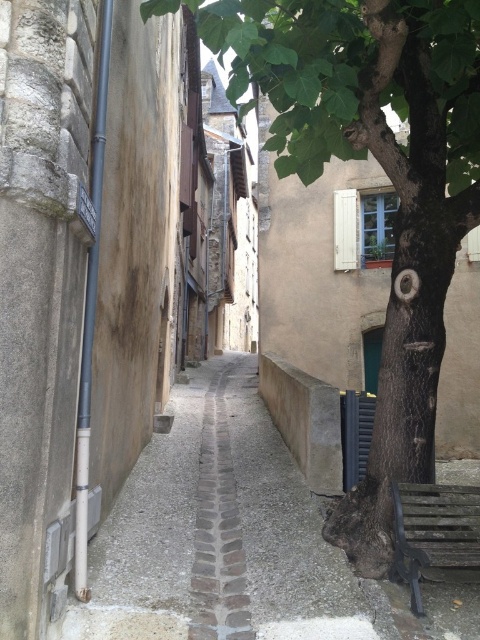
You are standing on the cobblestone street looking towards the buildings. There are two points marked on the ground. One is at point (377, 160) and the other is at point (214, 611). Which point is closer to you?

Point (377, 160) is further to the viewer than point (214, 611), so the point closer to you is point (214, 611).

You are standing in the middle of the gray cobblestone alley at center and want to walk towards the green rough bark tree at center. Which direction should you move to get closer to the tree?

Since the green rough bark tree at center is further to the viewer than the gray cobblestone alley at center, you should move forward along the alley to get closer to the tree.

You are a painter standing at the entrance of the gray cobblestone alley at center. You want to capture the green rough bark tree at center in your painting. Since you have a limited view, will the tree be fully visible in your painting if you focus on the center of the alley?

The green rough bark tree at center is taller than the gray cobblestone alley at center, so the tree will not be fully visible in the painting as its height exceeds the alleyway.